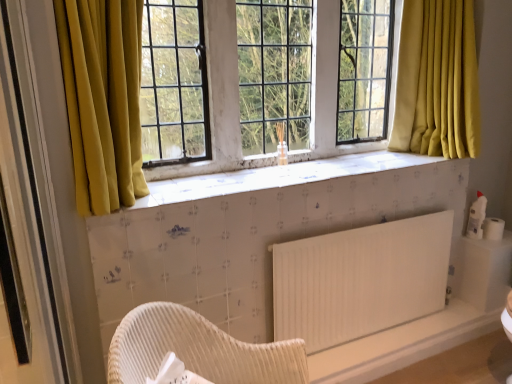
Question: From the image's perspective, is woven wood chair at lower center positioned above or below white textured tile at center?

Choices:
 (A) below
 (B) above

Answer: (A)

Question: Based on their positions, is woven wood chair at lower center located to the left or right of white textured tile at center?

Choices:
 (A) right
 (B) left

Answer: (B)

Question: Which object is the closest to the white matte toilet paper at right?

Choices:
 (A) woven wood chair at lower center
 (B) white textured tile at center
 (C) matte glass window screen at center
 (D) white matte radiator at lower right

Answer: (D)

Question: Estimate the real-world distances between objects in this image. Which object is closer to the white textured tile at center?

Choices:
 (A) white matte toilet paper at right
 (B) woven wood chair at lower center
 (C) white matte radiator at lower right
 (D) matte glass window screen at center

Answer: (D)